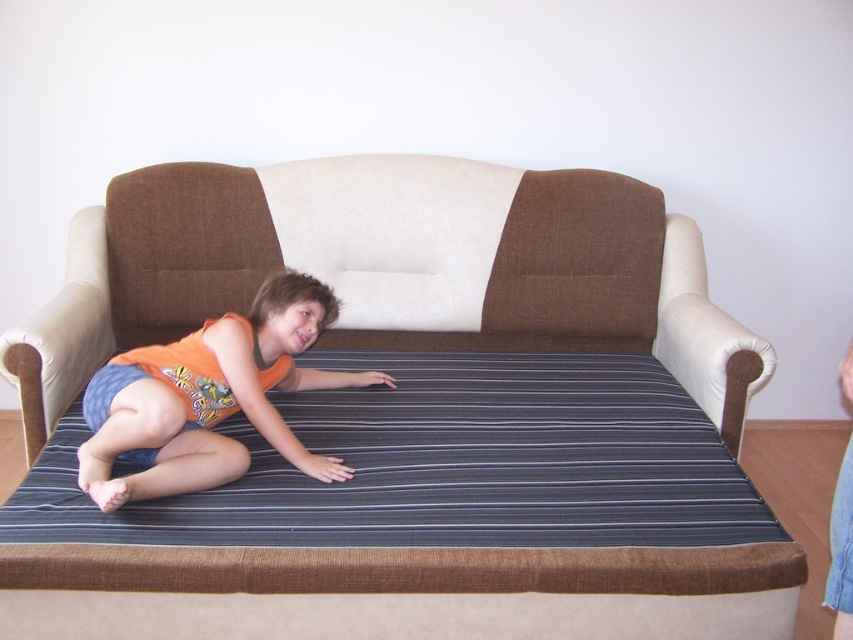
Is point (645, 538) closer to viewer compared to point (161, 378)?

Yes, point (645, 538) is closer to viewer.

Between point (175, 502) and point (216, 417), which one is positioned behind?

The point (216, 417) is more distant.

I want to click on brown fabric couch at center, so click(410, 417).

Locate an element on the screen. The height and width of the screenshot is (640, 853). brown fabric couch at center is located at coordinates (410, 417).